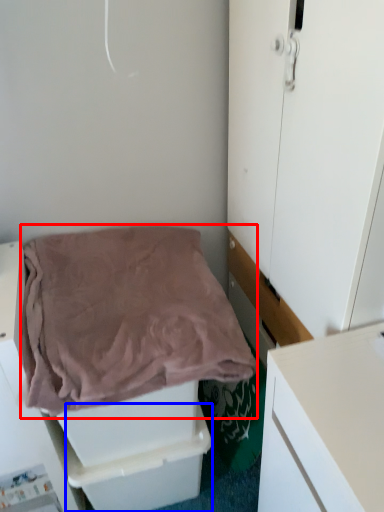
Question: Which object appears closest to the camera in this image, blanket (highlighted by a red box) or drawer (highlighted by a blue box)?

Choices:
 (A) blanket
 (B) drawer

Answer: (A)